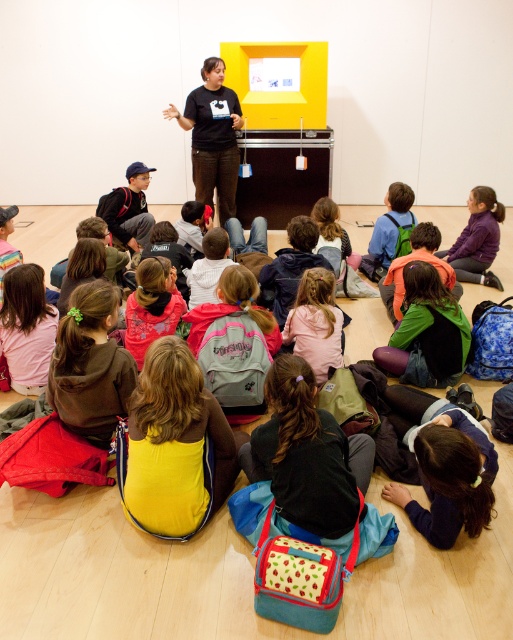
You are a teacher in the classroom and want to hand out a worksheet to the students. You see the pink fabric backpack at center and the purple fleece jacket at lower right. Which item is closer to the left side of the classroom?

The pink fabric backpack at center is to the left of the purple fleece jacket at lower right, so it is closer to the left side of the classroom.

You are a photographer trying to capture a photo of the black matte shirt at center and the purple fleece jacket at lower right. Which object should you focus on first if you want to capture both in the same frame without moving the camera?

The black matte shirt at center is to the left of the purple fleece jacket at lower right, so you should focus on the black matte shirt at center first to ensure both are in the frame.